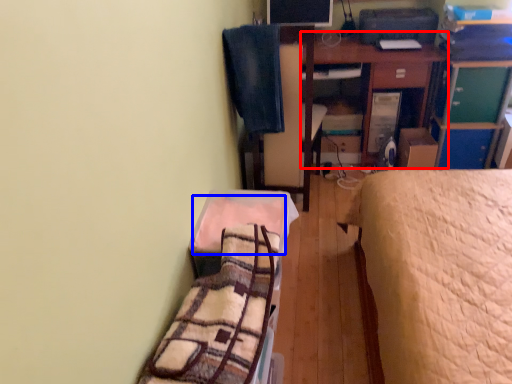
Question: Which object appears closest to the camera in this image, table (highlighted by a red box) or blanket (highlighted by a blue box)?

Choices:
 (A) table
 (B) blanket

Answer: (B)